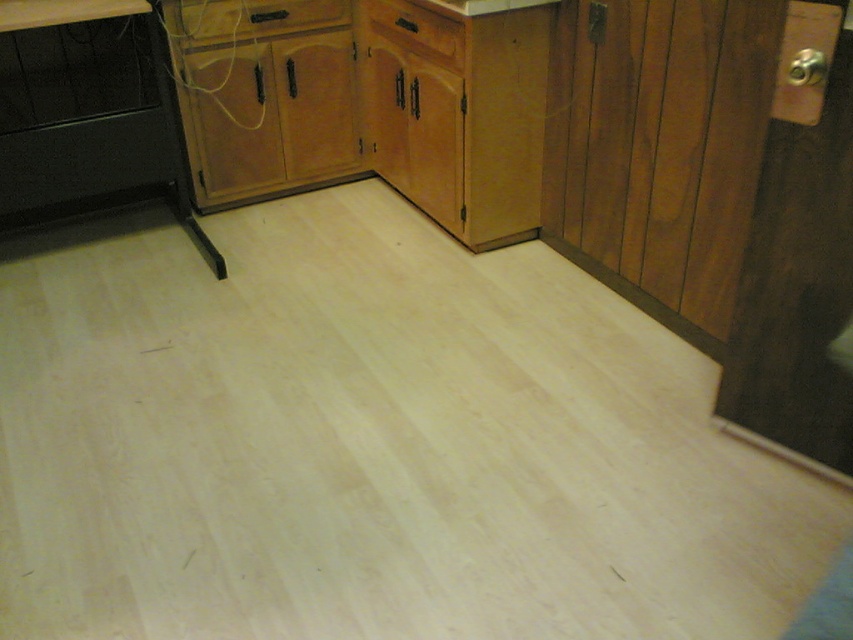
Question: Which point appears closest to the camera in this image?

Choices:
 (A) (398, 40)
 (B) (91, 3)
 (C) (341, 17)

Answer: (B)

Question: Is wooden drawer at upper center wider than wooden drawer at center?

Choices:
 (A) yes
 (B) no

Answer: (A)

Question: Which point appears closest to the camera in this image?

Choices:
 (A) (128, 60)
 (B) (102, 16)

Answer: (B)

Question: Is wooden drawer at upper center thinner than wooden drawer at center?

Choices:
 (A) no
 (B) yes

Answer: (A)

Question: Which object is the closest to the black matte stove at left?

Choices:
 (A) wooden drawer at center
 (B) white laminate counter top at upper left
 (C) wooden drawer at upper center

Answer: (B)

Question: Is wooden drawer at upper center to the left of wooden drawer at center from the viewer's perspective?

Choices:
 (A) no
 (B) yes

Answer: (B)